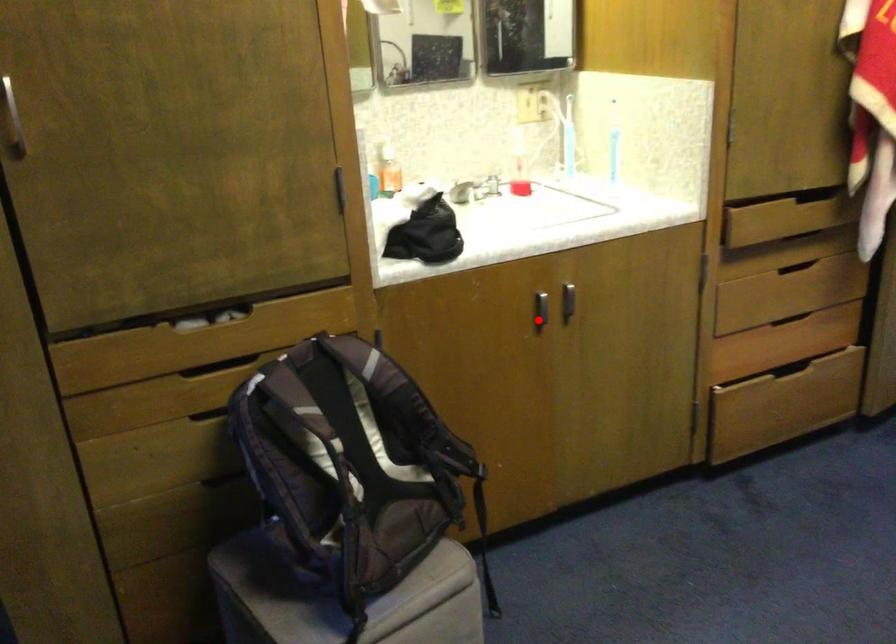
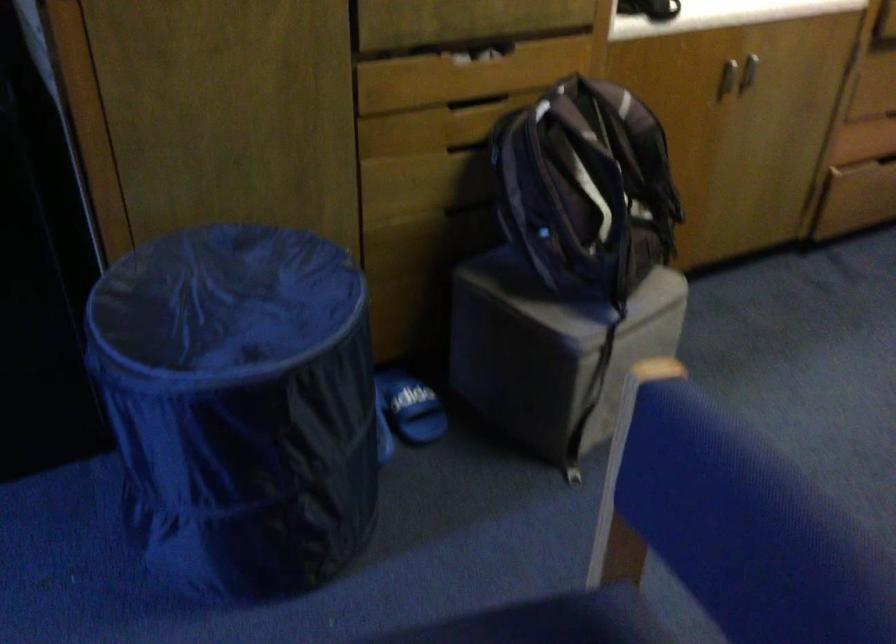
In the second image, find the point that corresponds to the highlighted location in the first image.

(728, 79)